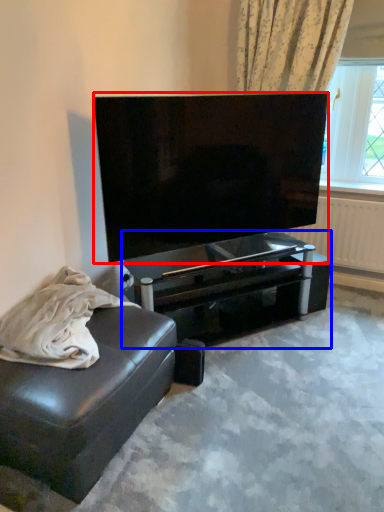
Question: Which point is closer to the camera, television (highlighted by a red box) or table (highlighted by a blue box)?

Choices:
 (A) television
 (B) table

Answer: (A)